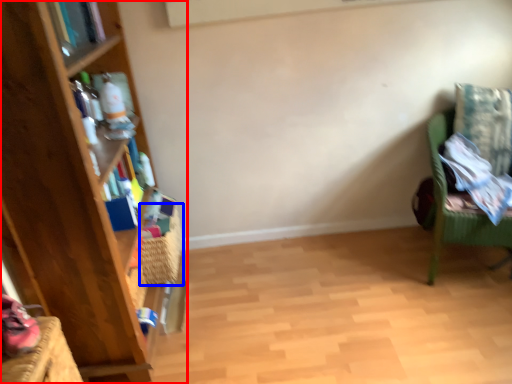
Question: Which object is further to the camera taking this photo, bookcase (highlighted by a red box) or basket (highlighted by a blue box)?

Choices:
 (A) bookcase
 (B) basket

Answer: (B)